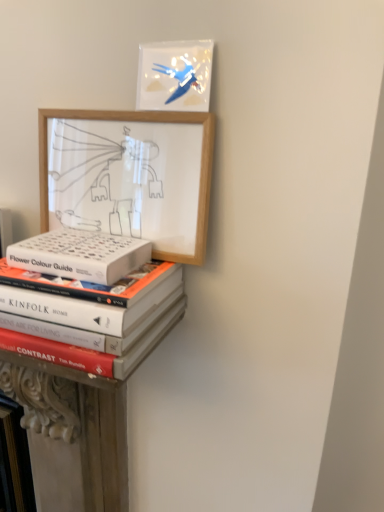
Question: Considering their positions, is matte plastic picture frame at upper center, the 1th picture frame when ordered from top to bottom, located in front of or behind wooden picture frame at upper left, the 1th picture frame in the bottom-to-top sequence?

Choices:
 (A) front
 (B) behind

Answer: (B)

Question: From a real-world perspective, relative to wooden picture frame at upper left, the 2th picture frame when ordered from top to bottom, is matte plastic picture frame at upper center, the 1th picture frame when ordered from top to bottom, vertically above or below?

Choices:
 (A) below
 (B) above

Answer: (B)

Question: Which is nearer to the hardcover books at lower left?

Choices:
 (A) matte plastic picture frame at upper center, the 1th picture frame when ordered from top to bottom
 (B) wooden picture frame at upper left, the 1th picture frame in the bottom-to-top sequence
 (C) white matte book at center
 (D) hardcover books at lower left

Answer: (D)

Question: Which object is positioned closest to the hardcover books at lower left?

Choices:
 (A) wooden picture frame at upper left, the 2th picture frame when ordered from top to bottom
 (B) matte plastic picture frame at upper center, the 1th picture frame when ordered from top to bottom
 (C) hardcover books at lower left
 (D) white matte book at center

Answer: (D)